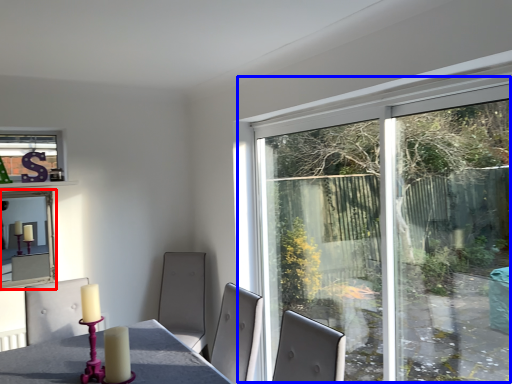
Question: Among these objects, which one is nearest to the camera, window screen (highlighted by a red box) or window (highlighted by a blue box)?

Choices:
 (A) window screen
 (B) window

Answer: (B)